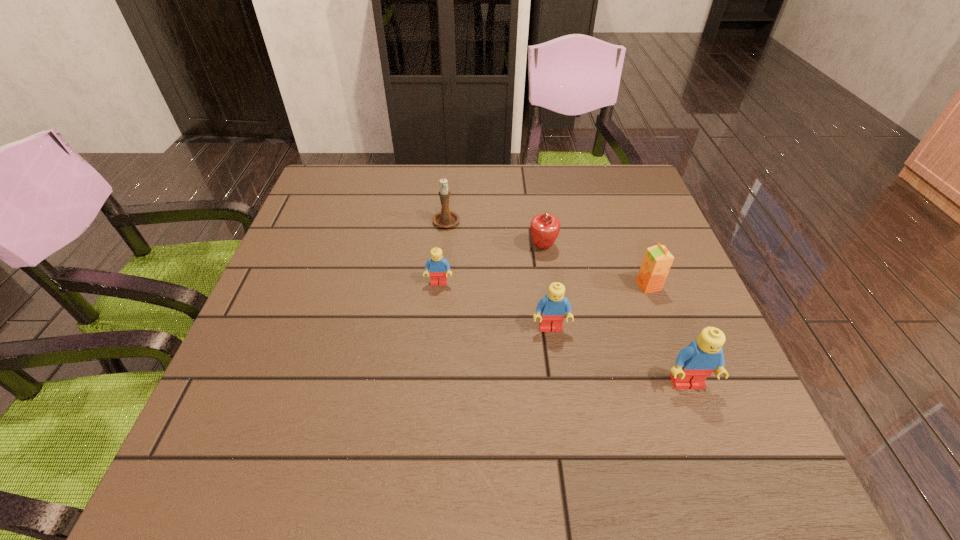
Find the location of a particular element. The width and height of the screenshot is (960, 540). blank space that satisfies the following two spatial constraints: 1. on the face of the shortest Lego; 2. on the right side of the orange juice is located at coordinates (439, 286).